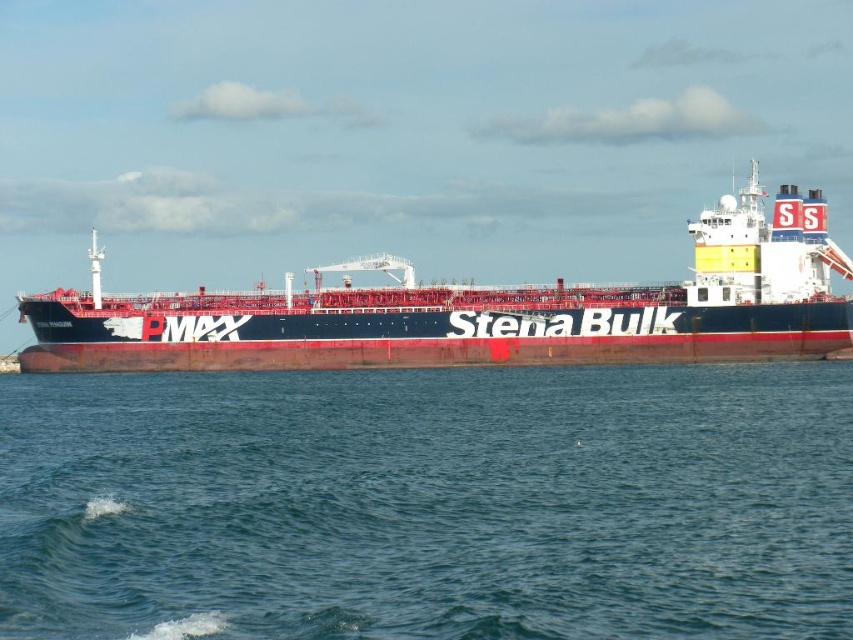
You are a sailor on the Stena Bulk ship. You notice the blue water at center and the red matte ship at center. Which one has a greater height from your viewpoint?

The red matte ship at center is taller than the blue water at center, so the red matte ship at center has a greater height from your viewpoint.

You are a marine biologist observing the Stena Bulk ship docked at the harbor. You notice the blue water at center and the red matte ship at center. Which object is located below the other?

The blue water at center is positioned under the red matte ship at center, so the blue water is below the ship.